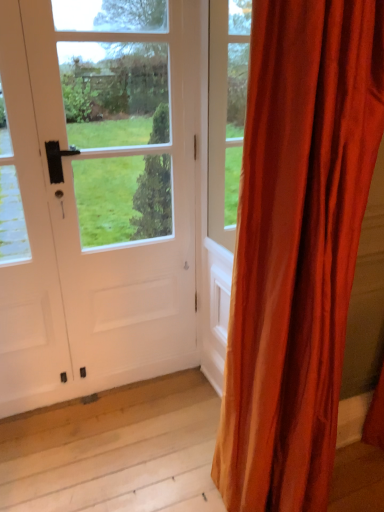
Image resolution: width=384 pixels, height=512 pixels. Describe the element at coordinates (96, 195) in the screenshot. I see `white matte door at center` at that location.

Locate an element on the screen. Image resolution: width=384 pixels, height=512 pixels. white matte door at center is located at coordinates pos(96,195).

Measure the distance between white matte door at center and camera.

The depth of white matte door at center is 1.39 meters.

Describe the element at coordinates (297, 246) in the screenshot. The width and height of the screenshot is (384, 512). I see `satin orange curtain at right` at that location.

The image size is (384, 512). In order to click on satin orange curtain at right in this screenshot , I will do `click(297, 246)`.

I want to click on white matte door at center, so click(96, 195).

Is white matte door at center to the left of satin orange curtain at right from the viewer's perspective?

Indeed, white matte door at center is positioned on the left side of satin orange curtain at right.

Is white matte door at center closer to the viewer compared to satin orange curtain at right?

No, the depth of white matte door at center is greater than that of satin orange curtain at right.

Considering the positions of point (19, 144) and point (329, 452), is point (19, 144) closer or farther from the camera than point (329, 452)?

Point (19, 144) is farther from the camera than point (329, 452).

From the image's perspective, is white matte door at center beneath satin orange curtain at right?

Incorrect, from the image's perspective, white matte door at center is higher than satin orange curtain at right.

From a real-world perspective, which is physically above, white matte door at center or satin orange curtain at right?

In real-world perspective, white matte door at center is above.

Can you confirm if white matte door at center is thinner than satin orange curtain at right?

Correct, the width of white matte door at center is less than that of satin orange curtain at right.

Between white matte door at center and satin orange curtain at right, which one has more height?

satin orange curtain at right.

Can you confirm if white matte door at center is smaller than satin orange curtain at right?

Correct, white matte door at center occupies less space than satin orange curtain at right.

Is white matte door at center inside the boundaries of satin orange curtain at right, or outside?

white matte door at center is not inside satin orange curtain at right, it's outside.

Would you consider white matte door at center to be distant from satin orange curtain at right?

white matte door at center is near satin orange curtain at right, not far away.

Is white matte door at center positioned with its back to satin orange curtain at right?

That's not correct — white matte door at center is not looking away from satin orange curtain at right.

Can you tell me how much white matte door at center and satin orange curtain at right differ in facing direction?

2.42 degrees.

This screenshot has height=512, width=384. Find the location of `door positioned vertically above the satin orange curtain at right (from a real-world perspective)`. door positioned vertically above the satin orange curtain at right (from a real-world perspective) is located at coordinates [x=96, y=195].

Considering the positions of objects satin orange curtain at right and white matte door at center in the image provided, who is more to the left, satin orange curtain at right or white matte door at center?

From the viewer's perspective, white matte door at center appears more on the left side.

Is the depth of satin orange curtain at right greater than that of white matte door at center?

That is False.

Does point (239, 430) come farther from viewer compared to point (104, 290)?

That is False.

From the image's perspective, which is below, satin orange curtain at right or white matte door at center?

satin orange curtain at right is shown below in the image.

From a real-world perspective, relative to white matte door at center, is satin orange curtain at right vertically above or below?

In terms of real-world spatial position, satin orange curtain at right is below white matte door at center.

Is satin orange curtain at right thinner than white matte door at center?

In fact, satin orange curtain at right might be wider than white matte door at center.

In the scene shown: Between satin orange curtain at right and white matte door at center, which one has more height?

Answer: satin orange curtain at right.

Can you confirm if satin orange curtain at right is smaller than white matte door at center?

Incorrect, satin orange curtain at right is not smaller in size than white matte door at center.

Is satin orange curtain at right inside the boundaries of white matte door at center, or outside?

satin orange curtain at right is not enclosed by white matte door at center.

Is satin orange curtain at right positioned far away from white matte door at center?

No.

Could you tell me if satin orange curtain at right is turned towards white matte door at center?

No, satin orange curtain at right does not turn towards white matte door at center.

How different are the orientations of satin orange curtain at right and white matte door at center in degrees?

2.42 degrees.

How much distance is there between satin orange curtain at right and white matte door at center?

33.24 inches.

The width and height of the screenshot is (384, 512). What are the coordinates of `door that appears on the left of satin orange curtain at right` in the screenshot? It's located at coord(96,195).

You are a GUI agent. You are given a task and a screenshot of the screen. Output one action in this format:
    pyautogui.click(x=<x>, y=<y>)
    Task: Click on the door lying on the left of satin orange curtain at right
    The height and width of the screenshot is (512, 384).
    Given the screenshot: What is the action you would take?
    pyautogui.click(x=96, y=195)

I want to click on curtain located on the right of white matte door at center, so click(x=297, y=246).